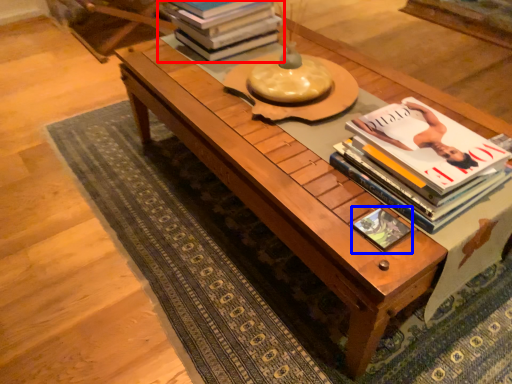
Question: Among these objects, which one is nearest to the camera, book (highlighted by a red box) or book cover (highlighted by a blue box)?

Choices:
 (A) book
 (B) book cover

Answer: (B)